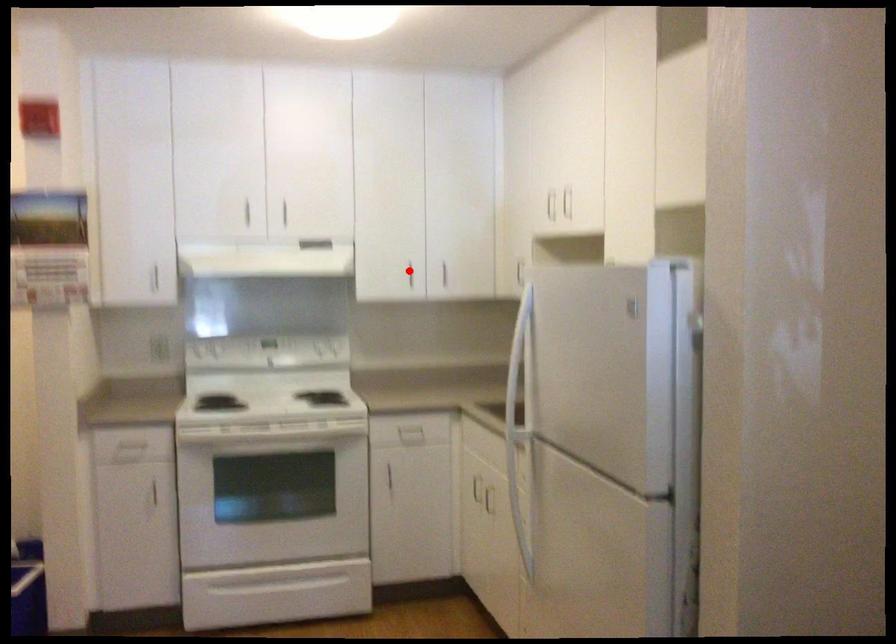
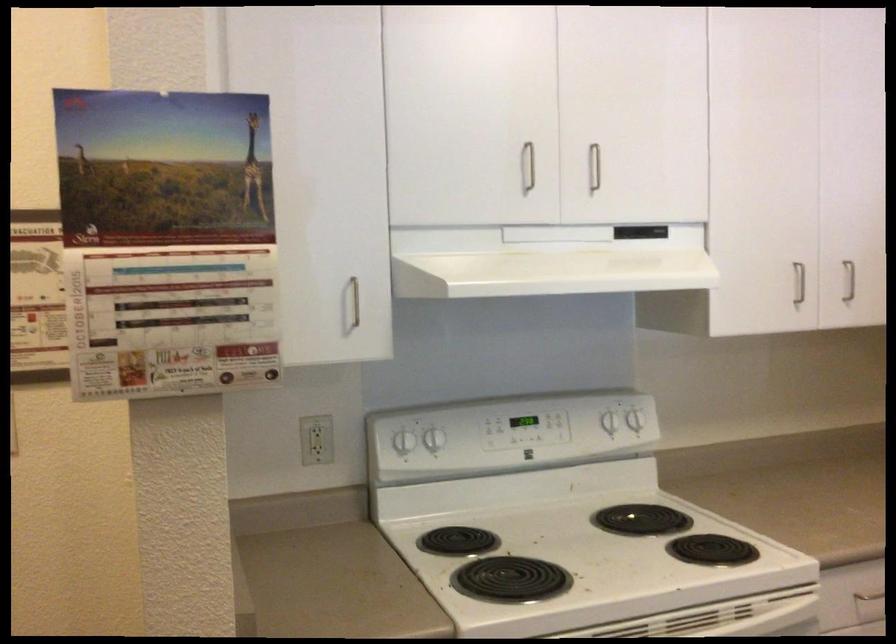
Where in the second image is the point corresponding to the highlighted location from the first image?

(798, 283)